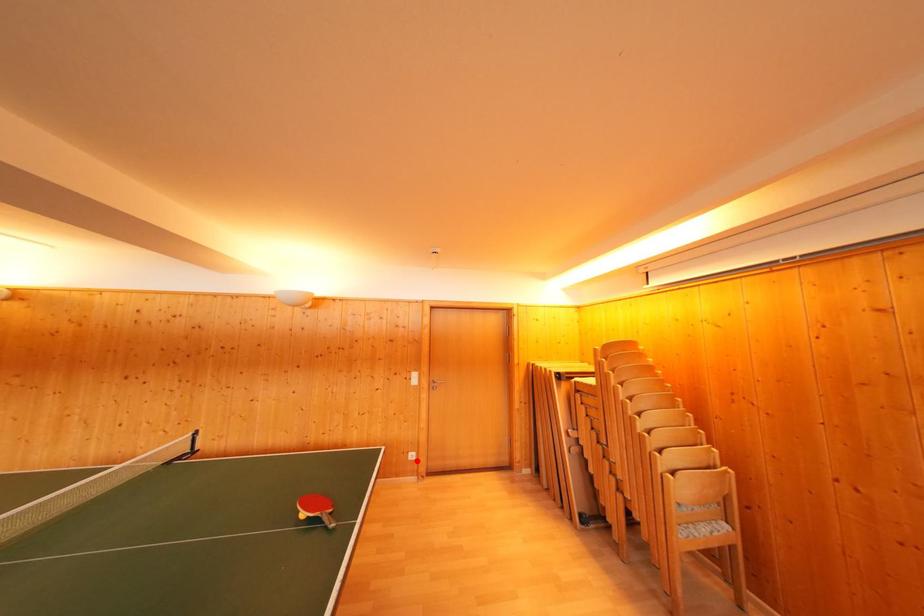
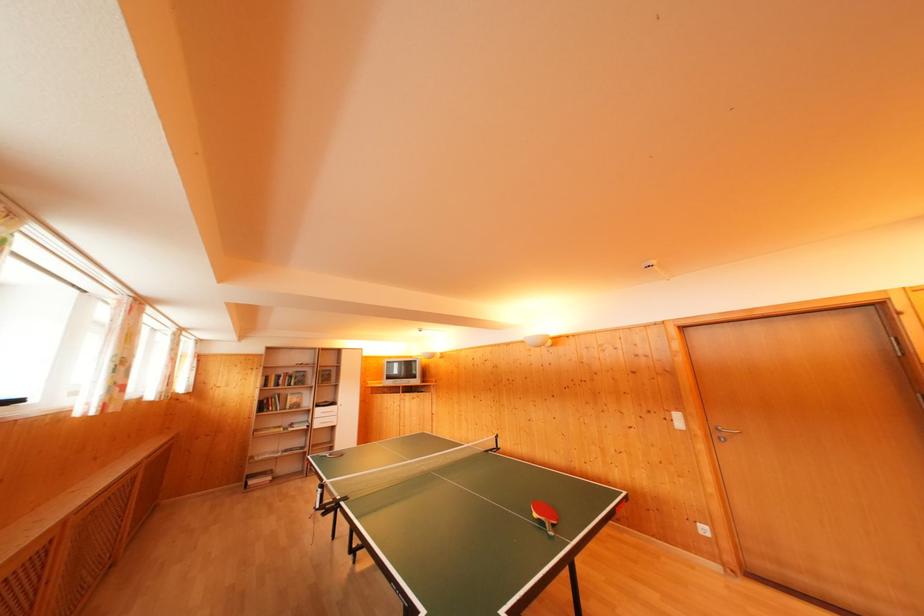
Question: I am providing you with two images of the same scene from different viewpoints. In image1, a red point is highlighted. Considering the same 3D point in image2, which of the following is correct?

Choices:
 (A) It is closer
 (B) It is farther

Answer: (A)